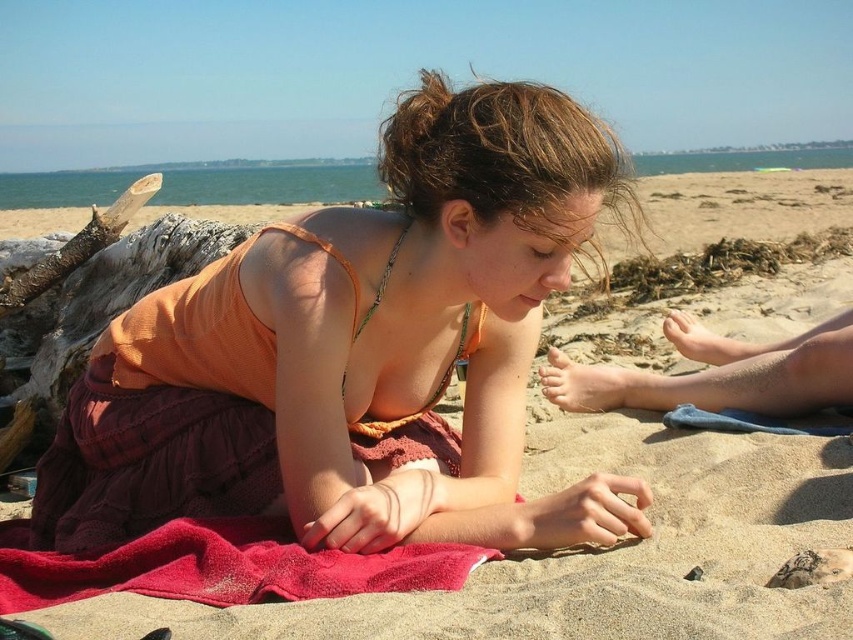
You are a beachgoer who wants to place your orange fabric dress at center on the red terry cloth at lower center. Can you confirm if there is enough space between them to place the dress?

The distance between the orange fabric dress at center and the red terry cloth at lower center is 13.38 inches, so yes, there is enough space to place the orange fabric dress at center on the red terry cloth at lower center.

You are a beachgoer who wants to lay out your belongings. You have an orange fabric dress at center and a red terry cloth at lower center. Which item should you choose if you need a larger surface area to cover yourself?

The orange fabric dress at center has a larger size compared to the red terry cloth at lower center, so you should choose the orange fabric dress at center for a larger surface area to cover yourself.

You are a photographer trying to capture the woman on the beach. You notice a point at coordinates (357,352). Based on the scene description, can you determine which part of her outfit this point corresponds to?

The point at (357,352) is on the orange fabric dress at center, so it corresponds to her orange tank top.